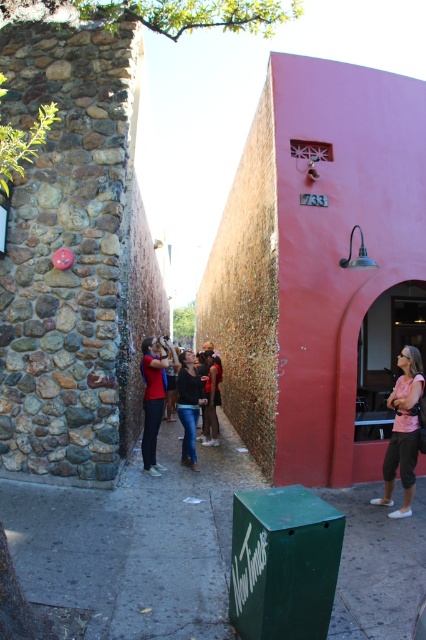
Can you confirm if pink fabric at center is bigger than denim jeans at center?

Incorrect, pink fabric at center is not larger than denim jeans at center.

Between pink fabric at center and denim jeans at center, which one has more height?

With more height is pink fabric at center.

Between point (386, 448) and point (180, 358), which one is positioned behind?

Positioned behind is point (180, 358).

Find the location of a particular element. This screenshot has width=426, height=640. pink fabric at center is located at coordinates coord(402,432).

Who is shorter, green painted concrete pavement at center or matte red shirt at center?

Standing shorter between the two is green painted concrete pavement at center.

Can you confirm if green painted concrete pavement at center is smaller than matte red shirt at center?

Incorrect, green painted concrete pavement at center is not smaller in size than matte red shirt at center.

Does point (29, 515) lie behind point (143, 372)?

No, (29, 515) is closer to viewer.

At what (x,y) coordinates should I click in order to perform the action: click on green painted concrete pavement at center. Please return your answer as a coordinate pair (x, y). Looking at the image, I should click on (135, 545).

Is green painted concrete pavement at center bigger than denim jeans at center?

Yes, green painted concrete pavement at center is bigger than denim jeans at center.

Is point (155, 534) in front of point (189, 360)?

That is True.

Locate an element on the screen. This screenshot has height=640, width=426. green painted concrete pavement at center is located at coordinates coord(135,545).